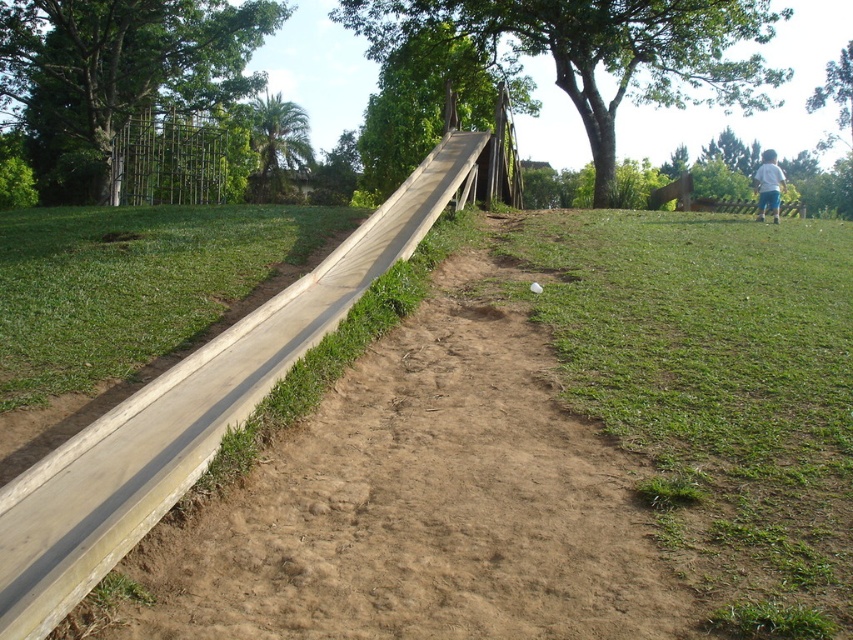
You are standing at the bottom of the slide and looking up towards the top. Which tree, the green leafy tree at upper center or the green wood tree at upper center, is positioned higher in the sky?

The green leafy tree at upper center is positioned higher in the sky than the green wood tree at upper center according to the description.

You are standing at the bottom of the slide and looking up. Which of the two trees at the upper left, the green leafy tree at upper left or the green leafy palm at upper left, is closer to your left side?

The green leafy tree at upper left is closer to your left side because it is positioned to the left of the green leafy palm at upper left.

You are a child looking up at the green leafy tree at upper left and the green leafy palm at upper left. Which one appears taller from your perspective?

The green leafy tree at upper left appears taller than the green leafy palm at upper left from your perspective.